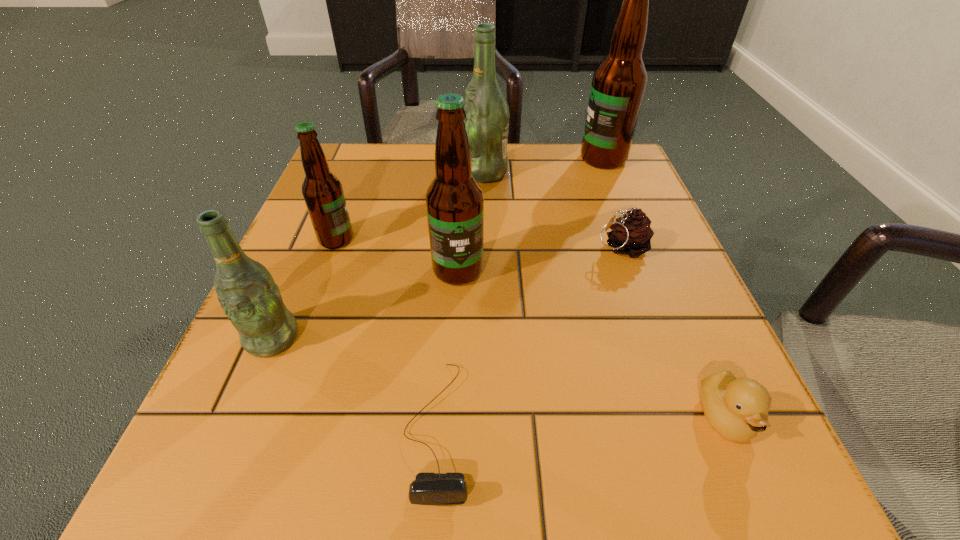
This screenshot has width=960, height=540. What are the coordinates of `the tallest beer bottle` in the screenshot? It's located at (618, 85).

Where is `the biggest brown beer bottle`? the biggest brown beer bottle is located at coordinates (618, 85).

I want to click on the farther green beer bottle, so click(x=487, y=113).

Identify the location of the bigger green beer bottle. The width and height of the screenshot is (960, 540). (487, 113).

This screenshot has height=540, width=960. In order to click on the second smallest brown beer bottle in this screenshot , I will do `click(454, 200)`.

Locate an element on the screen. The width and height of the screenshot is (960, 540). the nearest brown beer bottle is located at coordinates (454, 200).

The width and height of the screenshot is (960, 540). Find the location of `the third nearest beer bottle`. the third nearest beer bottle is located at coordinates (322, 191).

At what (x,y) coordinates should I click in order to perform the action: click on the leftmost brown beer bottle. Please return your answer as a coordinate pair (x, y). Looking at the image, I should click on (322, 191).

Find the location of a particular element. the left green beer bottle is located at coordinates (246, 290).

Locate an element on the screen. The width and height of the screenshot is (960, 540). the nearer green beer bottle is located at coordinates (x=246, y=290).